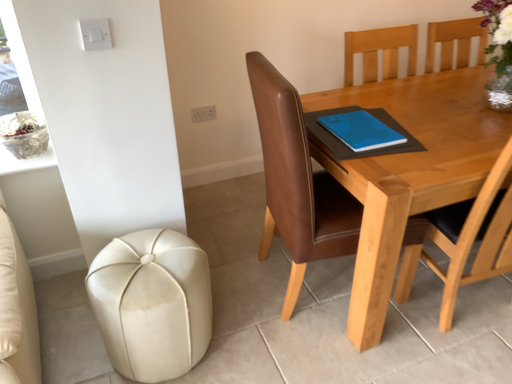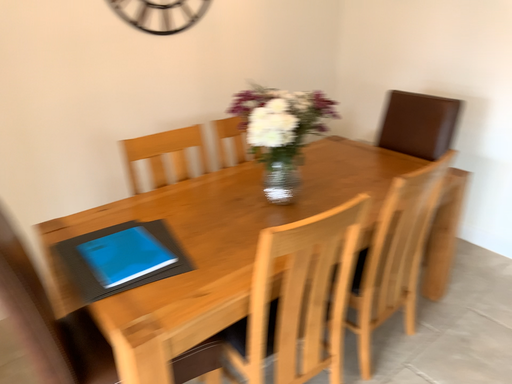
Question: Which way did the camera rotate in the video?

Choices:
 (A) rotated left
 (B) rotated right

Answer: (B)